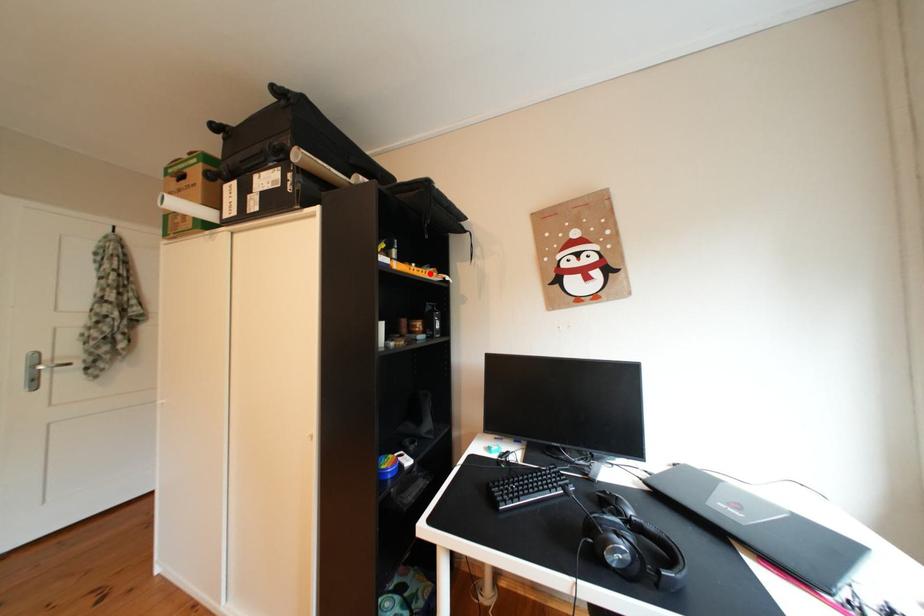
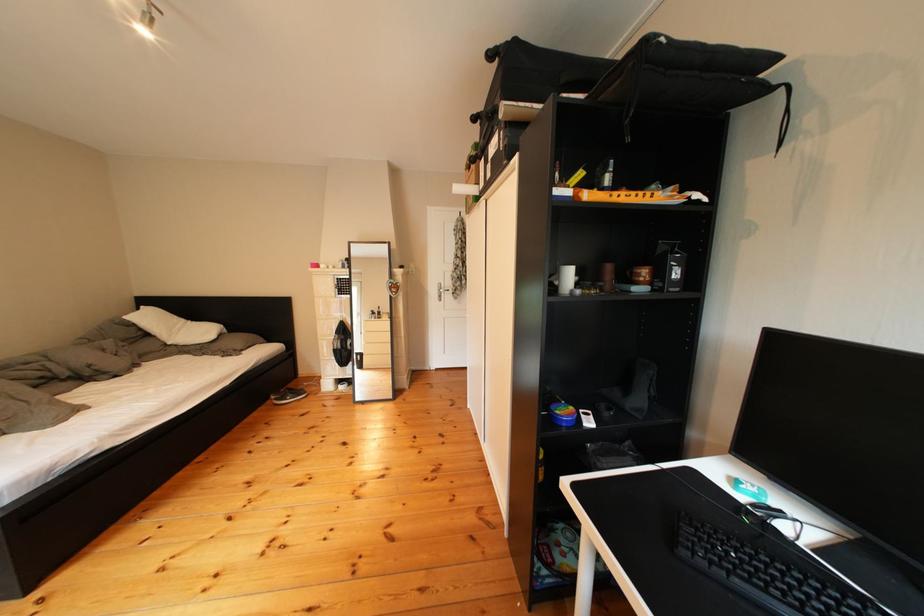
The point at the highlighted location is marked in the first image. Where is the corresponding point in the second image?

(638, 198)